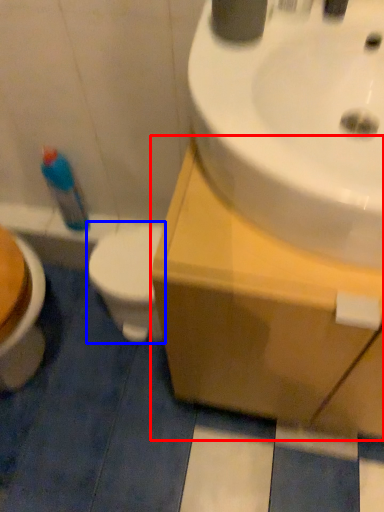
Question: Which object is closer to the camera taking this photo, counter top (highlighted by a red box) or toilet (highlighted by a blue box)?

Choices:
 (A) counter top
 (B) toilet

Answer: (A)